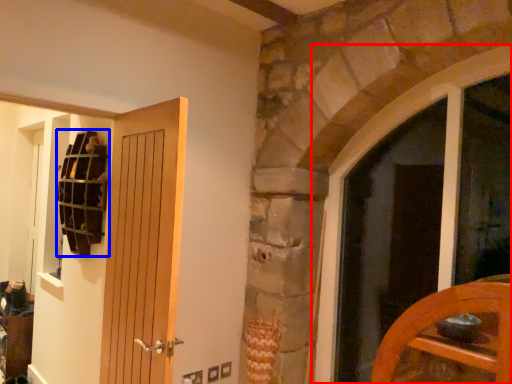
Question: Which point is further to the camera, window (highlighted by a red box) or shelf (highlighted by a blue box)?

Choices:
 (A) window
 (B) shelf

Answer: (B)